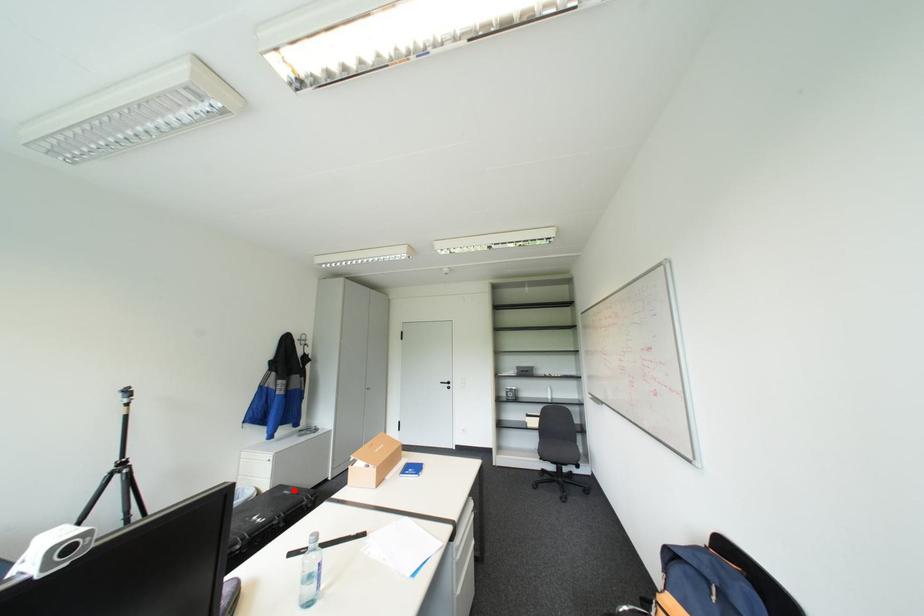
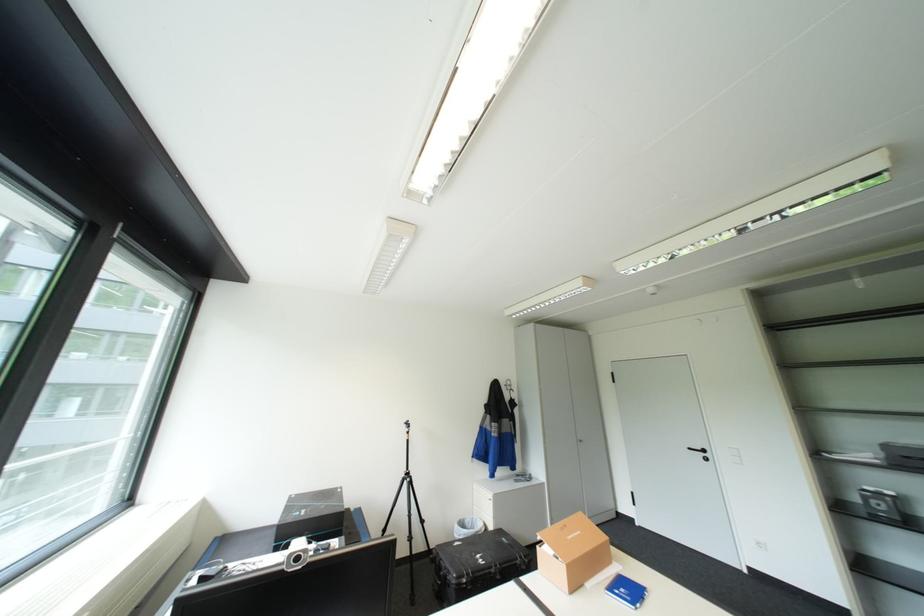
Find the pixel in the second image that matches the highlighted location in the first image.

(513, 538)